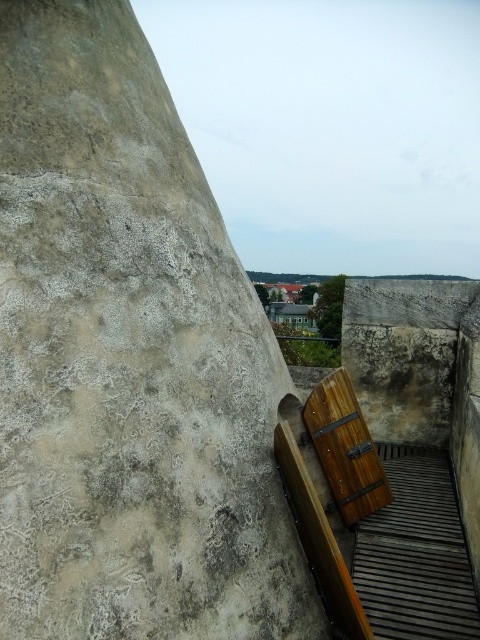
You are standing in front of the stone wall and the wooden door. There are two points marked on the wall at coordinates point (106, 422) and point (407, 506). Which point is nearer to you?

Point (106, 422) is closer to the viewer than point (407, 506).

You are standing in front of a stone wall with a wooden door to the right. There is a specific point marked at coordinates (128, 360). What material is located at that point?

The point at coordinates (128, 360) corresponds to gray rough concrete at upper left.

You are a maintenance worker inspecting the stone wall and the wooden door. You notice that the gray rough concrete at upper left and the wooden at right are part of the same structure. Based on their positions, which one is higher up?

→ The gray rough concrete at upper left is positioned over the wooden at right, so it is higher up.